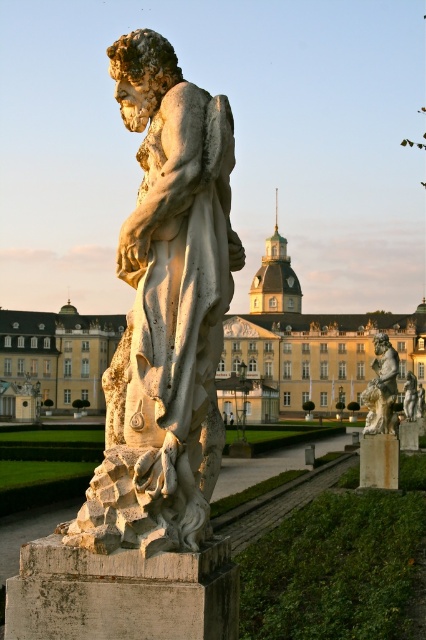
Question: Which of these objects is positioned farthest from the stone pillar at center?

Choices:
 (A) golden stone palace at center
 (B) smooth stone pillar at center
 (C) bronze textured cherub at center
 (D) white marble statue at center

Answer: (A)

Question: Is white marble statue at center smaller than stone pillar at center?

Choices:
 (A) no
 (B) yes

Answer: (A)

Question: Is bronze textured cherub at center closer to the viewer compared to stone pillar at center?

Choices:
 (A) yes
 (B) no

Answer: (B)

Question: Which is nearer to the smooth stone pillar at center?

Choices:
 (A) golden stone palace at center
 (B) white marble statue at center
 (C) stone pillar at center
 (D) bronze textured cherub at center

Answer: (B)

Question: Among these points, which one is nearest to the camera?

Choices:
 (A) (363, 444)
 (B) (195, 173)
 (C) (371, 428)
 (D) (69, 568)

Answer: (D)

Question: Does white marble statue at center have a lesser width compared to stone pillar at center?

Choices:
 (A) no
 (B) yes

Answer: (A)